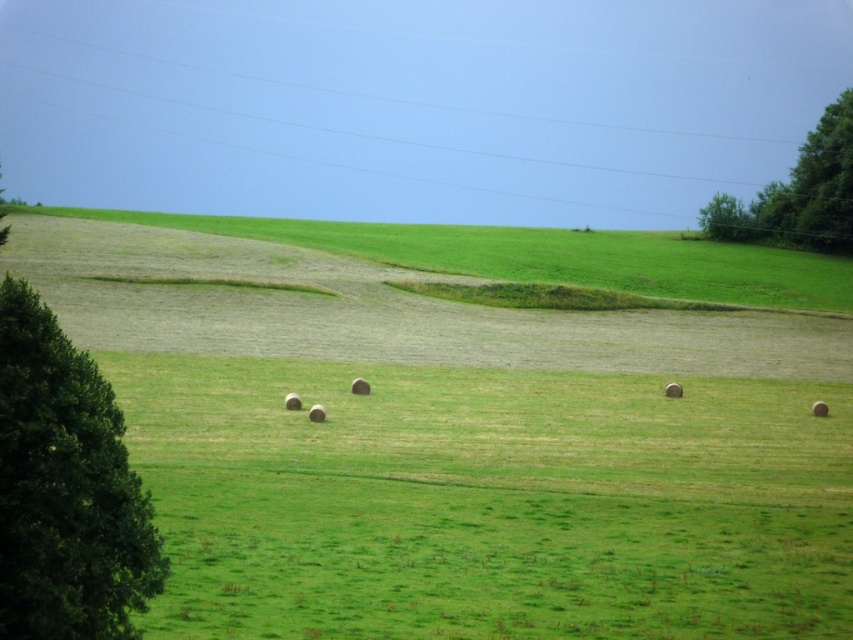
Does green grass at center lie behind green leafy tree at left?

Yes, green grass at center is further from the viewer.

Is green grass at center wider than green leafy tree at left?

Yes.

Locate an element on the screen. The image size is (853, 640). green grass at center is located at coordinates (489, 500).

Locate an element on the screen. green grass at center is located at coordinates (489, 500).

Who is more distant from viewer, (91, 440) or (811, 241)?

Positioned behind is point (811, 241).

Between point (73, 349) and point (728, 220), which one is positioned behind?

Point (728, 220)

Find the location of a particular element. This screenshot has height=640, width=853. green leafy tree at left is located at coordinates (65, 488).

Between green grass at center and green leafy tree at upper right, which one appears on the left side from the viewer's perspective?

Positioned to the left is green grass at center.

Between green grass at center and green leafy tree at upper right, which one has less height?

green grass at center

Between point (773, 560) and point (833, 150), which one is positioned in front?

Point (773, 560) is more forward.

Where is `green grass at center`? green grass at center is located at coordinates (489, 500).